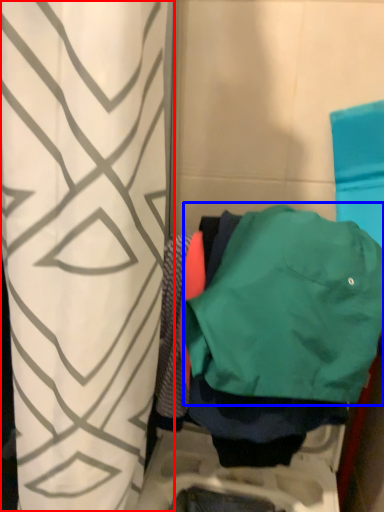
Question: Among these objects, which one is nearest to the camera, curtain (highlighted by a red box) or jacket (highlighted by a blue box)?

Choices:
 (A) curtain
 (B) jacket

Answer: (A)